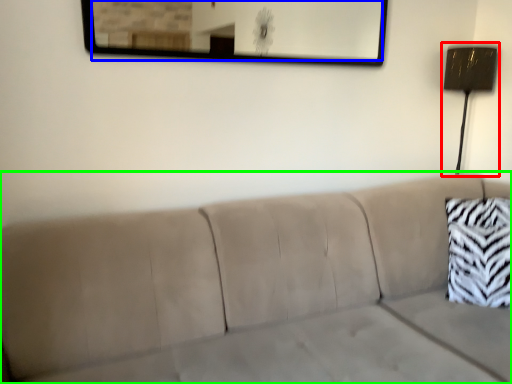
Question: Which object is the closest to the lamp (highlighted by a red box)? Choose among these: mirror (highlighted by a blue box) or studio couch (highlighted by a green box).

Choices:
 (A) mirror
 (B) studio couch

Answer: (B)